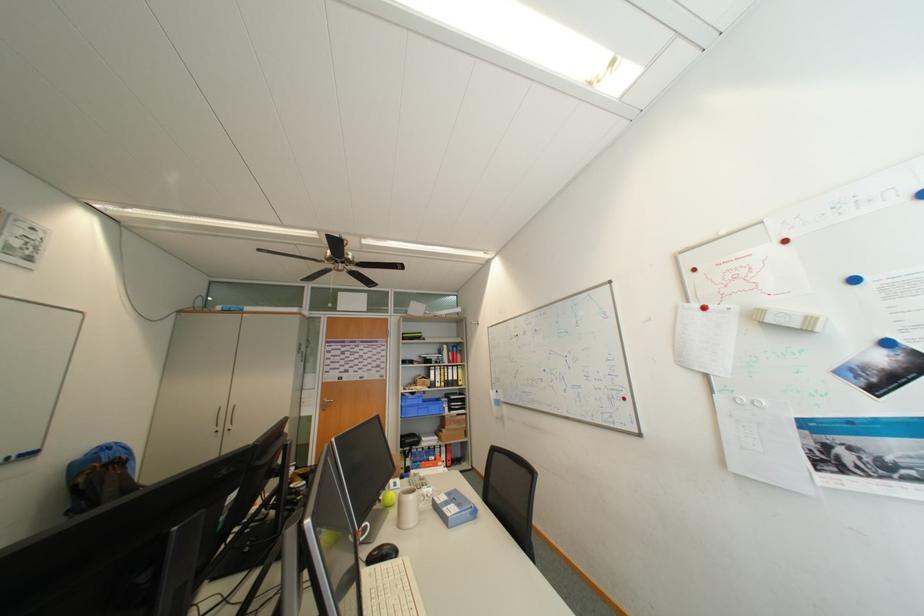
Where is `beige ceramic cup`? The width and height of the screenshot is (924, 616). beige ceramic cup is located at coordinates (407, 508).